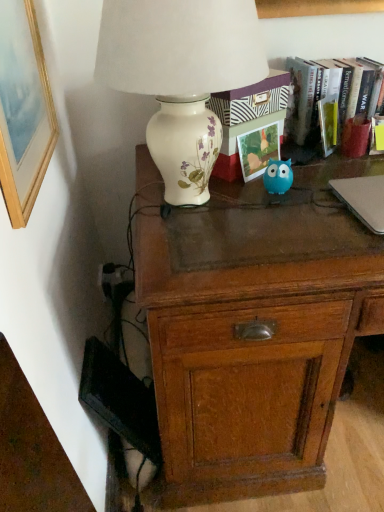
At what (x,y) coordinates should I click in order to perform the action: click on vacant region in front of porcelain floral lamp at upper left. Please return your answer as a coordinate pair (x, y). The width and height of the screenshot is (384, 512). Looking at the image, I should click on (227, 260).